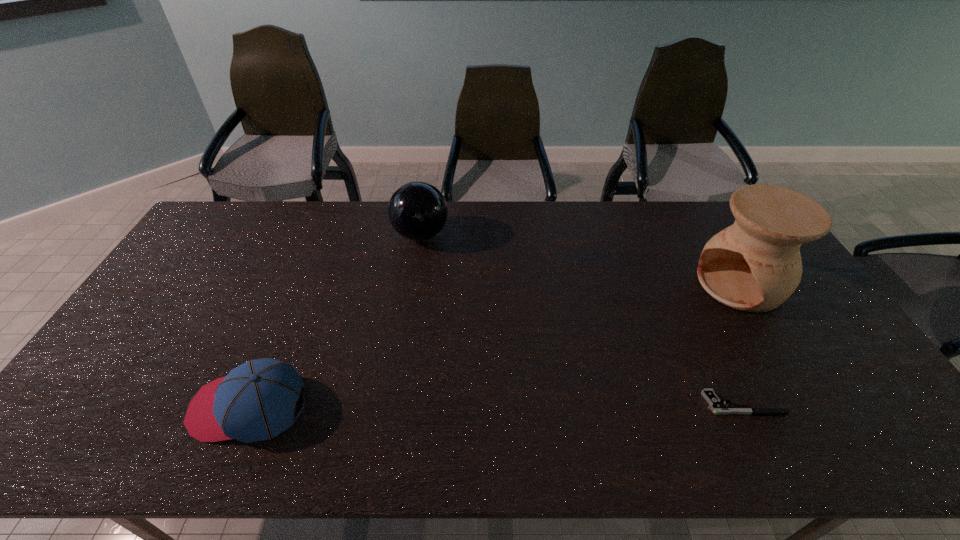
Locate an element on the screen. object positioned at the right edge is located at coordinates (754, 265).

At what (x,y) coordinates should I click in order to perform the action: click on vacant region at the far edge of the desktop. Please return your answer as a coordinate pair (x, y). Looking at the image, I should click on (588, 219).

Find the location of `vacant area at the near edge of the desktop`. vacant area at the near edge of the desktop is located at coordinates (516, 409).

In order to click on free space at the far left corner in this screenshot , I will do `click(244, 215)`.

You are a GUI agent. You are given a task and a screenshot of the screen. Output one action in this format:
    pyautogui.click(x=<x>, y=<y>)
    Task: Click on the free spot between the shortest object and the baseball cap
    This screenshot has width=960, height=540.
    Given the screenshot: What is the action you would take?
    pyautogui.click(x=496, y=405)

You are a GUI agent. You are given a task and a screenshot of the screen. Output one action in this format:
    pyautogui.click(x=<x>, y=<y>)
    Task: Click on the vacant area that lies between the third nearest object and the pistol
    
    Given the screenshot: What is the action you would take?
    pyautogui.click(x=741, y=344)

This screenshot has height=540, width=960. Identify the location of free space between the baseball cap and the farthest object. (335, 321).

You are a GUI agent. You are given a task and a screenshot of the screen. Output one action in this format:
    pyautogui.click(x=<x>, y=<y>)
    Task: Click on the unoccupied area between the bowling ball and the second farthest object
    The width and height of the screenshot is (960, 540).
    Given the screenshot: What is the action you would take?
    pyautogui.click(x=581, y=260)

The height and width of the screenshot is (540, 960). Identify the location of free space between the third tallest object and the third nearest object. (494, 346).

In order to click on empty location between the second farthest object and the baseball cap in this screenshot , I will do `click(494, 346)`.